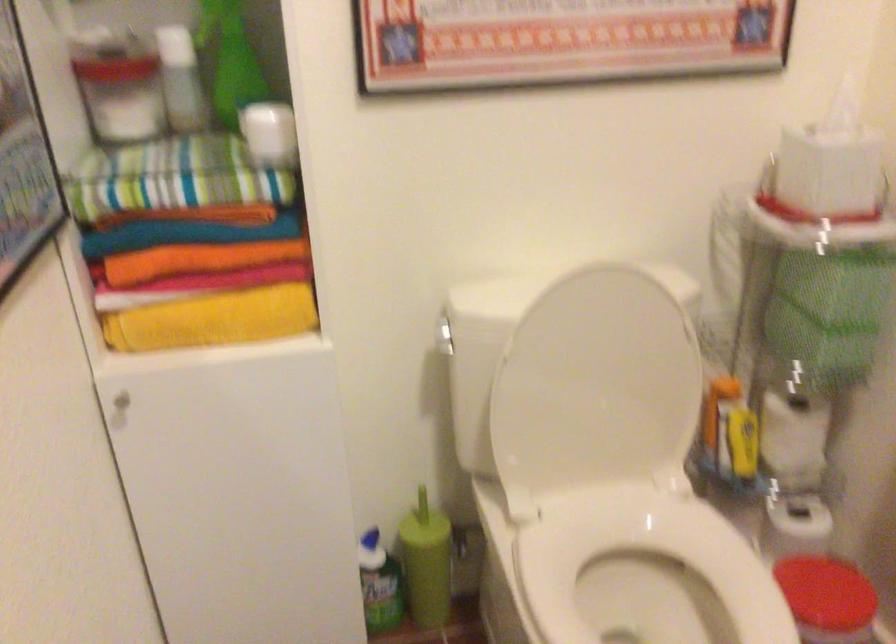
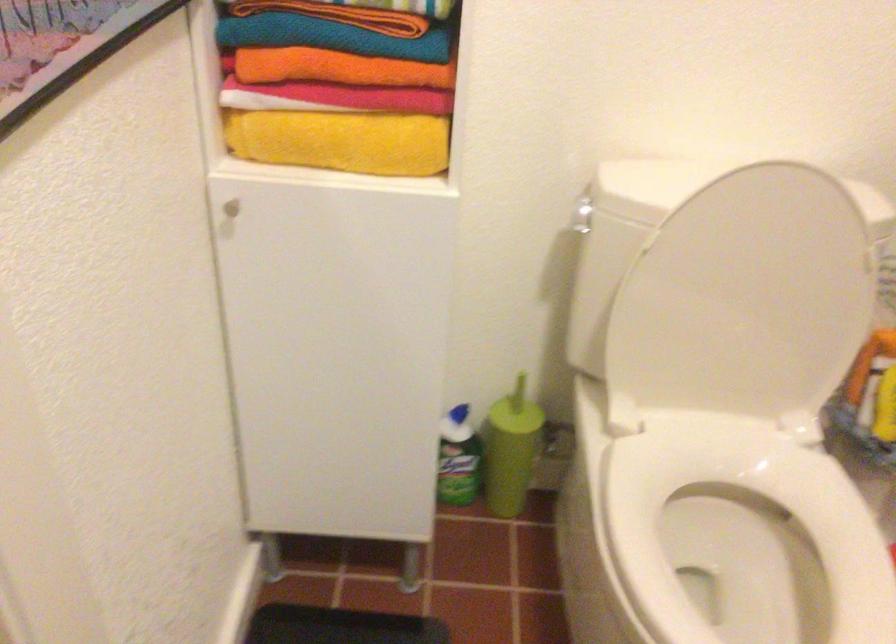
Locate, in the second image, the point that corresponds to (119,404) in the first image.

(228, 210)